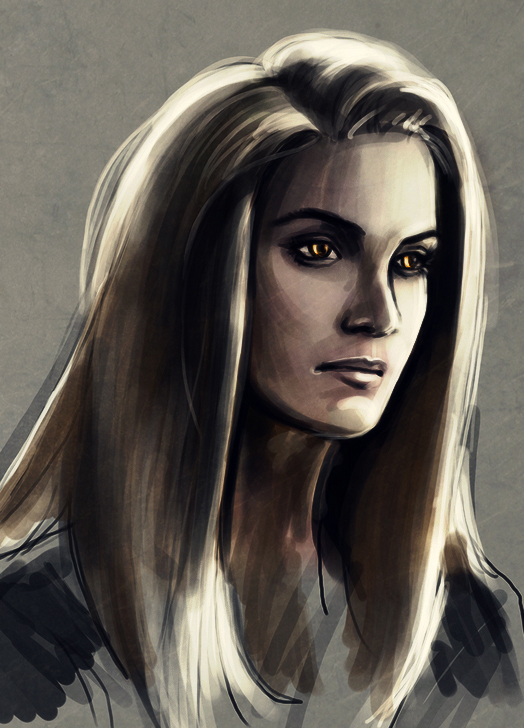
I want to click on painting, so click(160, 255).